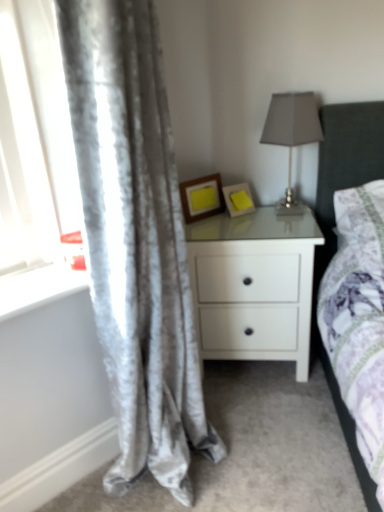
Locate an element on the screen. This screenshot has width=384, height=512. vacant area situated to the left side of yellow matte picture frame at upper center, placed as the second picture frame when sorted from left to right is located at coordinates (211, 220).